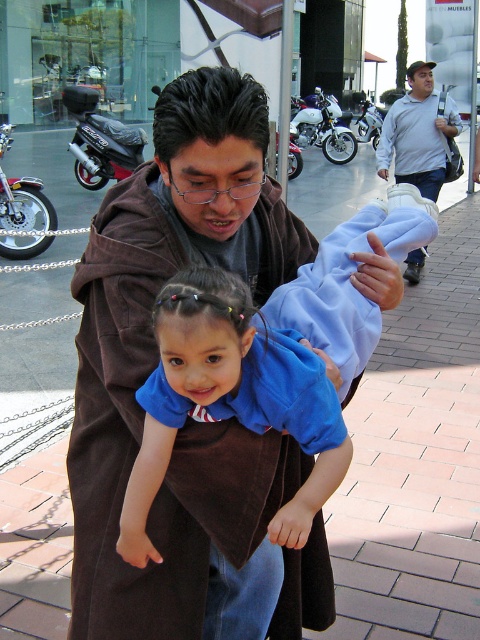
You are a delivery person who needs to park your electric scooter near the point marked at coordinates (323, 125). The parking area is a paved walkway with red bricks. Is the parking spot at that coordinate suitable for your scooter?

The point at coordinates (323, 125) marks a white matte motorcycle at center, so the parking spot there is occupied by a motorcycle and not suitable for your scooter.

You are a delivery person who needs to carry a large package through the walkway. You see the brown soft robe at center and the black matte scooter at upper left in your path. Which object takes up more space in the walkway?

The black matte scooter at upper left takes up more space in the walkway than the brown soft robe at center because the brown soft robe at center occupies less space than black matte scooter at upper left.

You are a delivery person who needs to park your motorcycle between the white matte motorcycle at center and the silver metallic motorcycle at center. Based on their heights, which motorcycle should you place your motorcycle next to to ensure it doesn

The white matte motorcycle at center is taller than the silver metallic motorcycle at center. To park your motorcycle between them without blocking the view, you should place it next to the silver metallic motorcycle at center since it is shorter and less likely to obstruct the path.